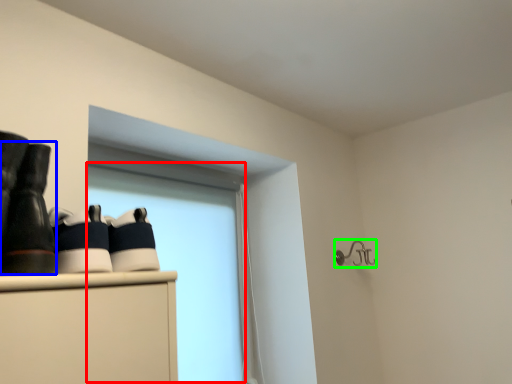
Question: Which object is positioned closest to window screen (highlighted by a red box)? Select from footwear (highlighted by a blue box) and shower (highlighted by a green box).

Choices:
 (A) footwear
 (B) shower

Answer: (B)